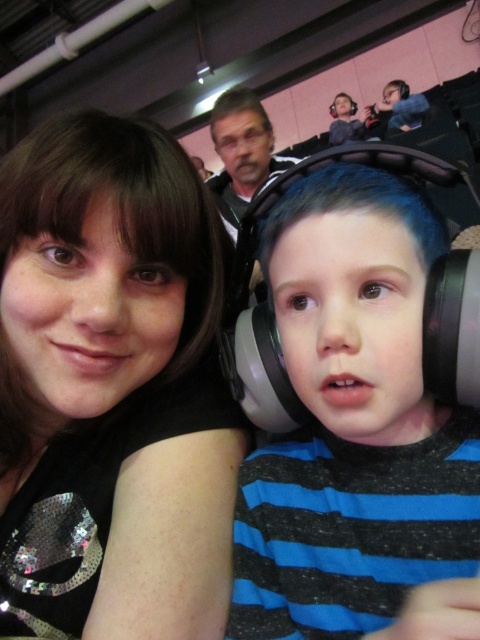
You are a photographer standing at the camera position. You want to take a closeup shot of the black sequined shirt at upper left. Can you reach it with your hand if you extend your arm fully? Assume your arm is 24 inches long when extended.

The black sequined shirt at upper left is 18.36 inches away from the camera. Since your arm can extend 24 inches, which is longer than the distance, you can reach the black sequined shirt at upper left.

You are an event coordinator trying to place a new banner between the black sequined shirt at upper left and the young boy on the right. Based on their positions, where should the banner be placed to ensure it is centered between them?

The banner should be placed between the black sequined shirt at upper left and the young boy on the right at the midpoint between their positions.

You are a photographer at the event and want to capture a photo where the black sequined shirt at upper left and the matte plastic headphones at center are both clearly visible. Considering their sizes, which object should you focus on to ensure both are in frame?

The black sequined shirt at upper left is much taller than the matte plastic headphones at center, so focusing on the larger object first would help ensure both are in frame.